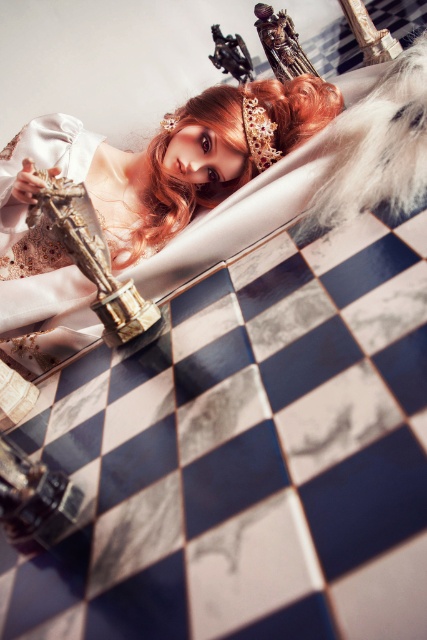
Question: Considering the relative positions of satin white dress at center and blonde silky hair at center in the image provided, where is satin white dress at center located with respect to blonde silky hair at center?

Choices:
 (A) right
 (B) left

Answer: (B)

Question: Which point is closer to the camera?

Choices:
 (A) (231, 163)
 (B) (294, 113)

Answer: (A)

Question: Is satin white dress at center to the right of blonde silky hair at center from the viewer's perspective?

Choices:
 (A) yes
 (B) no

Answer: (B)

Question: Is satin white dress at center further to the viewer compared to blonde silky hair at center?

Choices:
 (A) no
 (B) yes

Answer: (A)